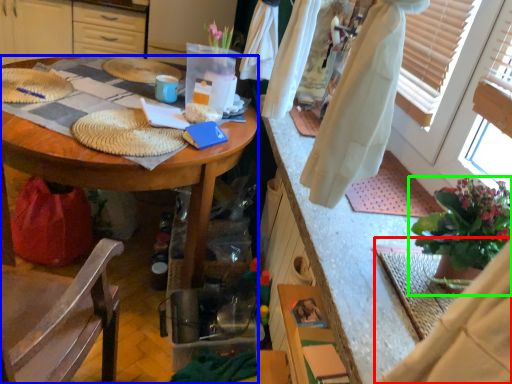
Question: Which object is the farthest from robe (highlighted by a red box)? Choose among these: desk (highlighted by a blue box) or houseplant (highlighted by a green box).

Choices:
 (A) desk
 (B) houseplant

Answer: (A)